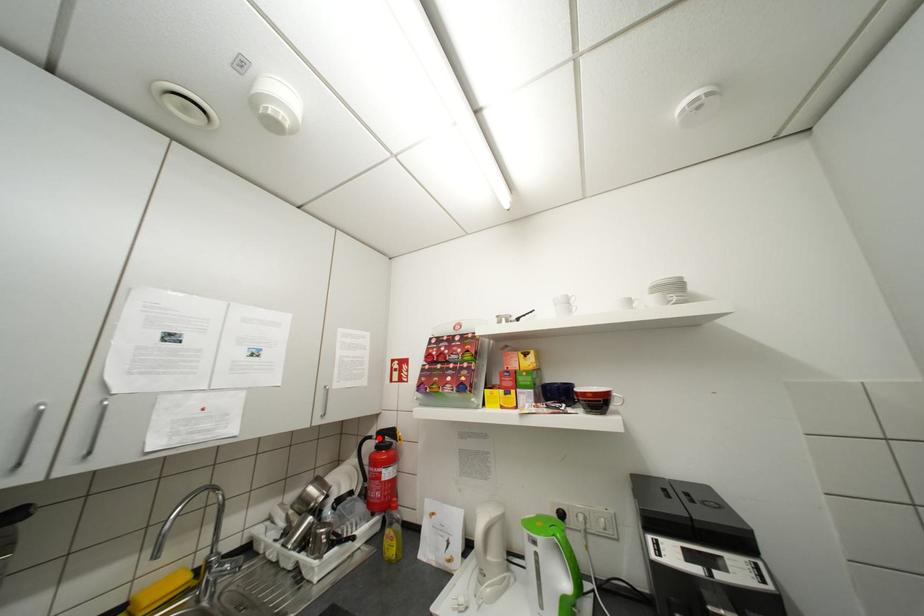
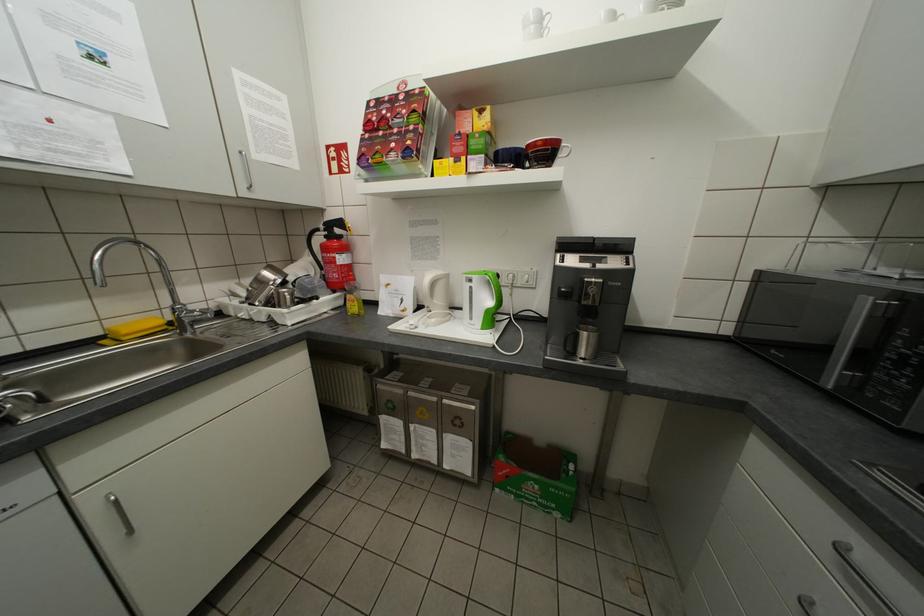
Question: A red point is marked in image1. In image2, is the corresponding 3D point closer to the camera or farther? Reply with the corresponding letter.

Choices:
 (A) The corresponding 3D point is closer.
 (B) The corresponding 3D point is farther.

Answer: (A)